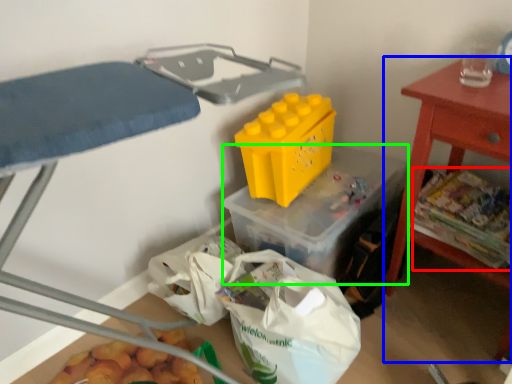
Question: Which object is positioned closest to food (highlighted by a red box)? Select from table (highlighted by a blue box) and storage box (highlighted by a green box).

Choices:
 (A) table
 (B) storage box

Answer: (A)